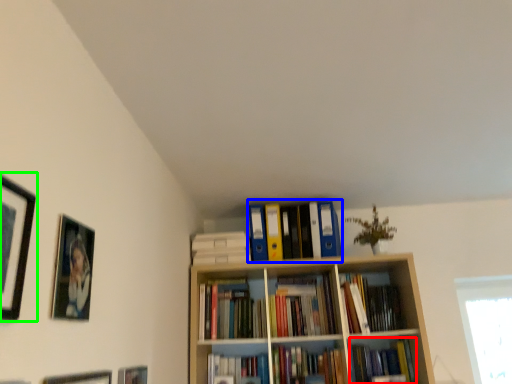
Question: Which is farther away from book (highlighted by a red box)? book (highlighted by a blue box) or picture frame (highlighted by a green box)?

Choices:
 (A) book
 (B) picture frame

Answer: (B)